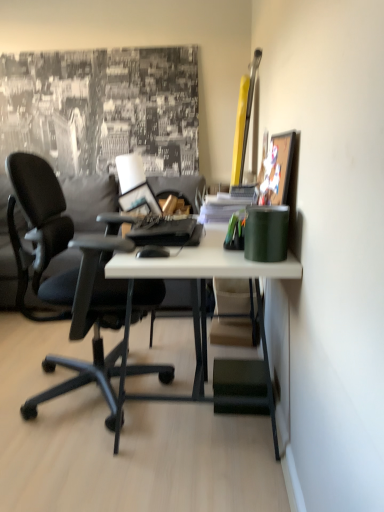
At what (x,y) coordinates should I click in order to perform the action: click on vacant space to the left of white matte desk at center. Please return your answer as a coordinate pair (x, y). The width and height of the screenshot is (384, 512). Looking at the image, I should click on (66, 407).